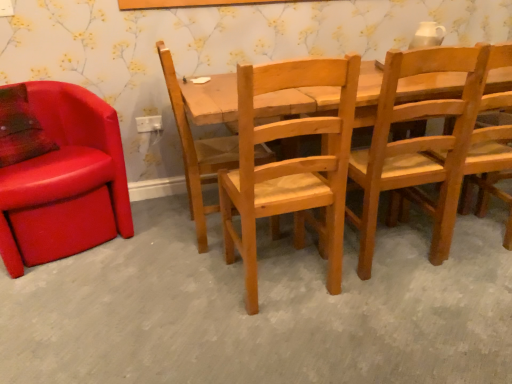
Find the location of `blank space situated above wooden chair at lower center (from a real-world perspective)`. blank space situated above wooden chair at lower center (from a real-world perspective) is located at coordinates (239, 284).